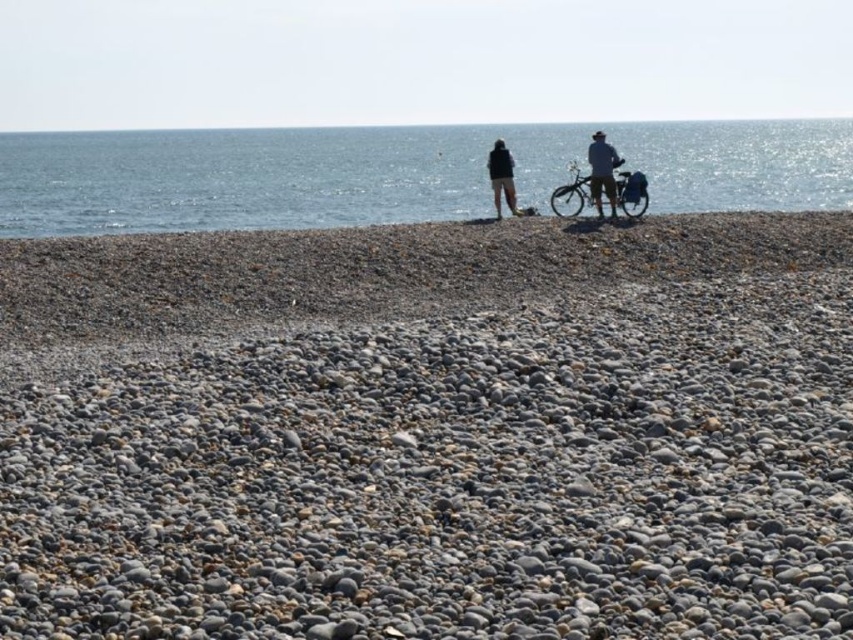
Question: Which of these objects is positioned farthest from the shiny metallic bicycle at right?

Choices:
 (A) black matte jacket at center
 (B) blue water at upper center

Answer: (B)

Question: From the image, what is the correct spatial relationship of smooth pebbles at center in relation to matte black jacket at center?

Choices:
 (A) below
 (B) above

Answer: (A)

Question: Is shiny metallic bicycle at right to the right of black matte jacket at center from the viewer's perspective?

Choices:
 (A) yes
 (B) no

Answer: (A)

Question: Does matte black jacket at center appear on the right side of light blue denim jacket at center?

Choices:
 (A) no
 (B) yes

Answer: (A)

Question: Estimate the real-world distances between objects in this image. Which object is closer to the black matte jacket at center?

Choices:
 (A) light blue denim jacket at center
 (B) shiny metallic bicycle at right
 (C) smooth pebbles at center
 (D) blue water at upper center

Answer: (B)

Question: Among these objects, which one is farthest from the camera?

Choices:
 (A) shiny metallic bicycle at right
 (B) black matte jacket at center

Answer: (A)